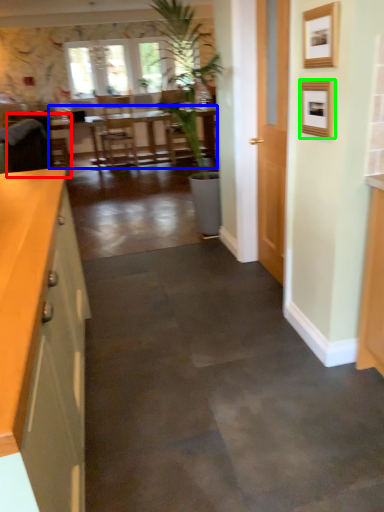
Question: Which object is the closest to the armchair (highlighted by a red box)? Choose among these: table (highlighted by a blue box) or picture frame (highlighted by a green box).

Choices:
 (A) table
 (B) picture frame

Answer: (B)